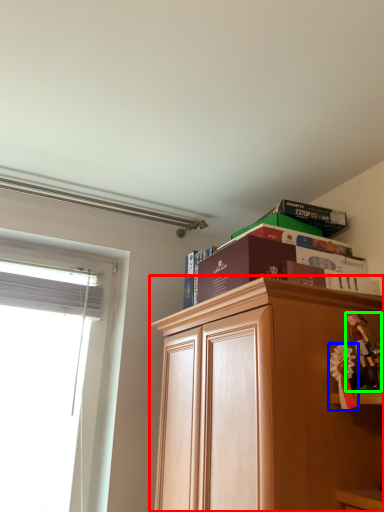
Question: Which object is the closest to the cabinetry (highlighted by a red box)? Choose among these: toy (highlighted by a blue box) or toy (highlighted by a green box).

Choices:
 (A) toy
 (B) toy

Answer: (A)